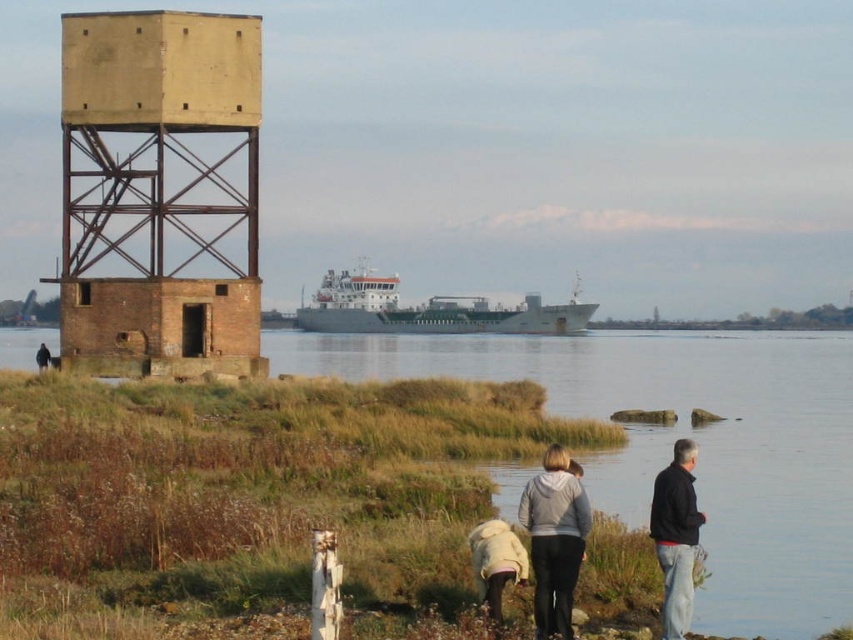
Question: Which point is closer to the camera taking this photo?

Choices:
 (A) pos(347,362)
 (B) pos(532,515)
 (C) pos(527,564)
 (D) pos(445,300)

Answer: (C)

Question: Among these points, which one is farthest from the camera?

Choices:
 (A) (251, 301)
 (B) (664, 538)

Answer: (A)

Question: Can you confirm if yellowish concrete observation tower at left is wider than dark blue jacket at lower right?

Choices:
 (A) yes
 (B) no

Answer: (A)

Question: Is dark blue jacket at lower right to the right of white fleece jacket at lower center from the viewer's perspective?

Choices:
 (A) no
 (B) yes

Answer: (B)

Question: Does light gray hoodie at lower center have a larger size compared to white fleece jacket at lower center?

Choices:
 (A) no
 (B) yes

Answer: (B)

Question: Which of the following is the closest to the observer?

Choices:
 (A) (196, 230)
 (B) (560, 612)
 (C) (589, 525)
 (D) (415, 328)

Answer: (B)